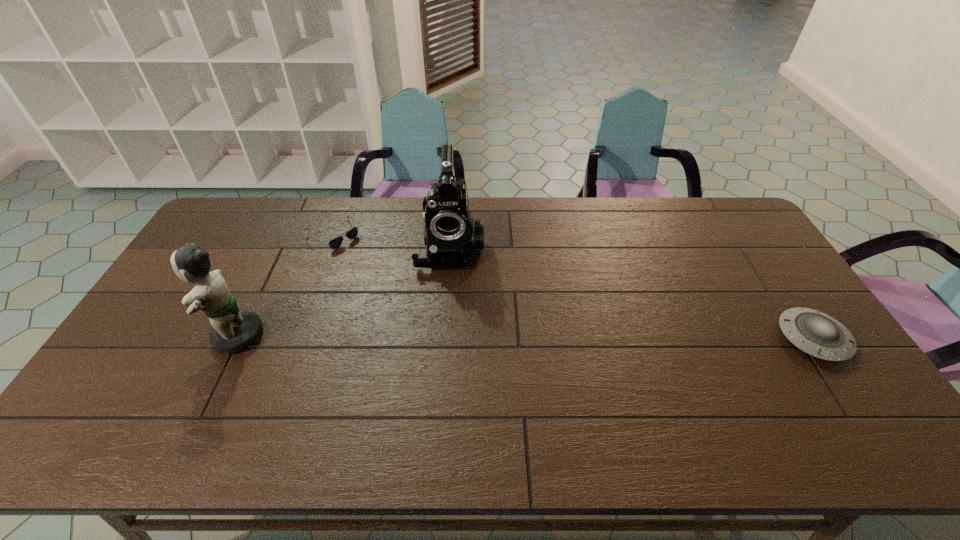
Locate an element on the screen. free space located on the lenses of the sunglasses is located at coordinates (416, 295).

The image size is (960, 540). What are the coordinates of `blank area located on the lenses of the sunglasses` in the screenshot? It's located at (384, 272).

Find the location of a particular element. Image resolution: width=960 pixels, height=540 pixels. free region located 0.320m on the lenses of the sunglasses is located at coordinates (413, 293).

Identify the location of camcorder present at the far edge. The image size is (960, 540). (450, 235).

Locate an element on the screen. sunglasses present at the far edge is located at coordinates (335, 243).

Locate an element on the screen. object located at the right edge is located at coordinates tap(815, 333).

I want to click on free space at the far edge of the desktop, so click(632, 215).

In the image, there is a desktop. What are the coordinates of `vacant space at the near edge` in the screenshot? It's located at (325, 381).

I want to click on free space at the left edge of the desktop, so click(160, 312).

Locate an element on the screen. The image size is (960, 540). vacant space at the right edge of the desktop is located at coordinates tap(760, 289).